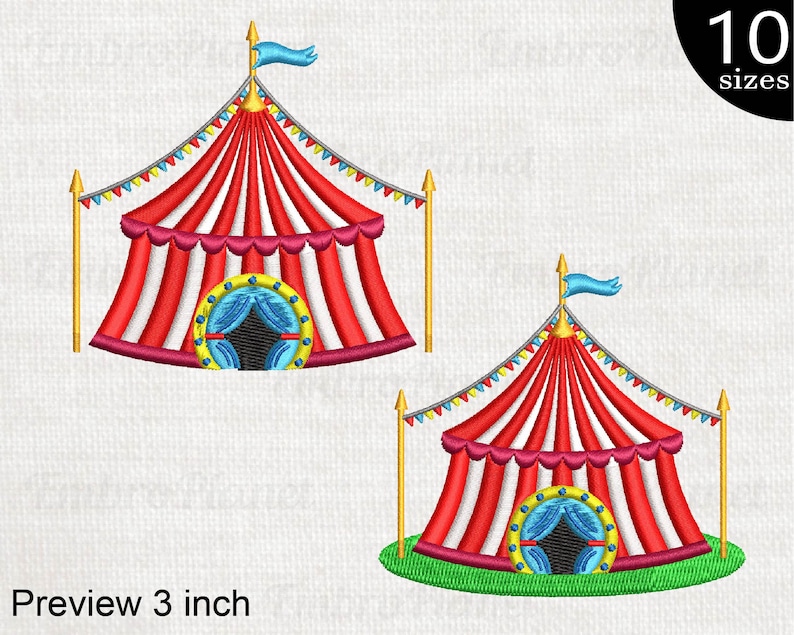
Find the location of `blue door curtains`. blue door curtains is located at coordinates (225, 326), (276, 317), (533, 523), (590, 521).